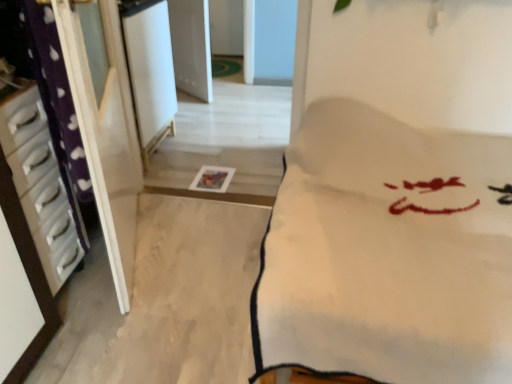
Question: Is point pyautogui.click(x=40, y=190) positioned closer to the camera than point pyautogui.click(x=159, y=97)?

Choices:
 (A) closer
 (B) farther

Answer: (A)

Question: Looking at the image, does white glossy drawer at left, marked as the first furniture in a left-to-right arrangement, seem bigger or smaller compared to white glossy screen door at upper center?

Choices:
 (A) small
 (B) big

Answer: (A)

Question: Which of these objects is positioned farthest from the white glossy screen door at upper center?

Choices:
 (A) white glossy drawer at left, marked as the first furniture in a left-to-right arrangement
 (B) white soft blanket at center, which appears as the 2th furniture when viewed from the left

Answer: (B)

Question: Which of these objects is positioned closest to the white soft blanket at center, which appears as the 2th furniture when viewed from the left?

Choices:
 (A) white glossy drawer at left, marked as the first furniture in a left-to-right arrangement
 (B) white glossy screen door at upper center

Answer: (A)